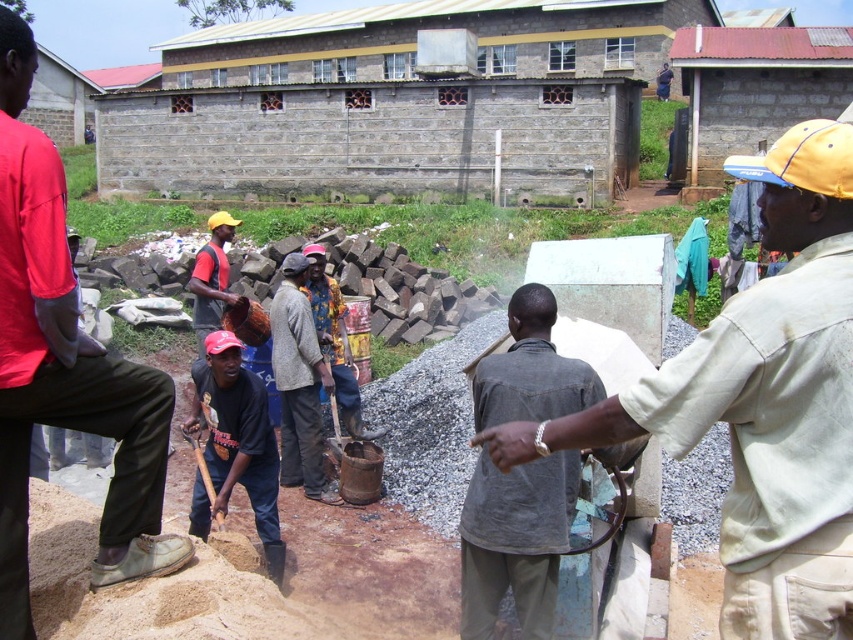
Question: Can you confirm if light beige fabric shirt at center is smaller than flannel shirt at center?

Choices:
 (A) no
 (B) yes

Answer: (A)

Question: Among these objects, which one is nearest to the camera?

Choices:
 (A) dark blue shirt at center
 (B) dark gray shirt at center
 (C) light beige fabric shirt at center

Answer: (C)

Question: Is dark gray shirt at center above dark blue shirt at center?

Choices:
 (A) no
 (B) yes

Answer: (B)

Question: Is red shirt at left below dark blue shirt at center?

Choices:
 (A) yes
 (B) no

Answer: (B)

Question: Which object is the closest to the flannel shirt at center?

Choices:
 (A) dark gray shirt at center
 (B) dark blue shirt at center
 (C) light beige fabric shirt at center

Answer: (B)

Question: Which object is farther from the camera taking this photo?

Choices:
 (A) dark blue shirt at center
 (B) red shirt at left
 (C) light beige fabric shirt at center

Answer: (A)